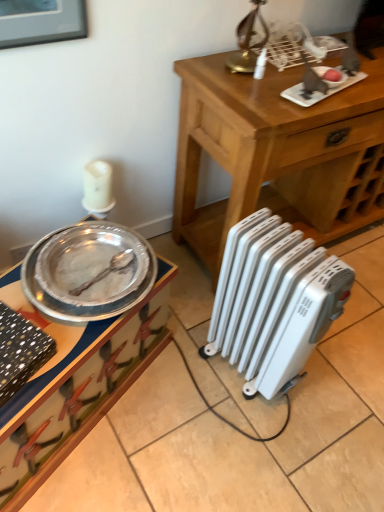
Find the location of a particular element. vacant space situated on the left part of white plastic radiator at lower right is located at coordinates (185, 362).